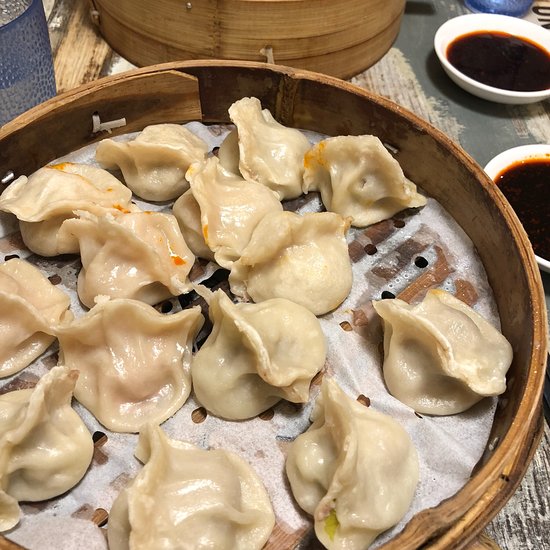
Where is `basket`? basket is located at coordinates (458, 190).